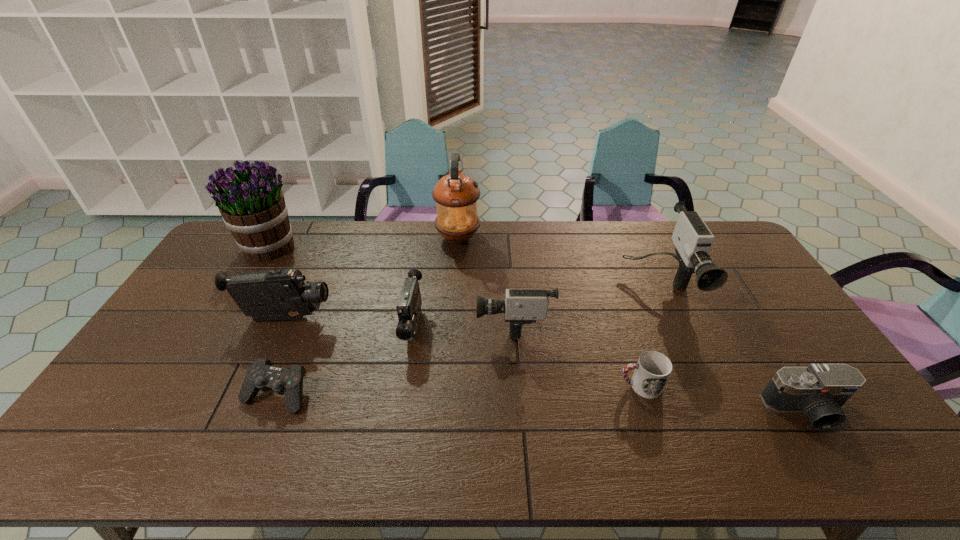
This screenshot has height=540, width=960. Identify the location of camcorder that is positioned at the far edge. (693, 240).

Locate an element on the screen. Image resolution: width=960 pixels, height=540 pixels. object present at the left edge is located at coordinates (252, 205).

Image resolution: width=960 pixels, height=540 pixels. I want to click on object located at the right edge, so click(x=819, y=391).

The image size is (960, 540). Identify the location of object that is positioned at the far left corner. (252, 205).

This screenshot has height=540, width=960. Find the location of `vacant region at the far edge of the desktop`. vacant region at the far edge of the desktop is located at coordinates (593, 242).

In the image, there is a desktop. Where is `vacant space at the near edge`? The width and height of the screenshot is (960, 540). vacant space at the near edge is located at coordinates (564, 446).

Image resolution: width=960 pixels, height=540 pixels. I want to click on vacant space at the left edge of the desktop, so click(122, 398).

Where is `vacant space at the right edge of the desktop`? This screenshot has height=540, width=960. vacant space at the right edge of the desktop is located at coordinates click(x=800, y=366).

Image resolution: width=960 pixels, height=540 pixels. Identify the location of vacant area at the near right corner. point(825,463).

Locate an element on the screen. This screenshot has height=540, width=960. free area in between the oil lamp and the purple bouquet is located at coordinates (364, 242).